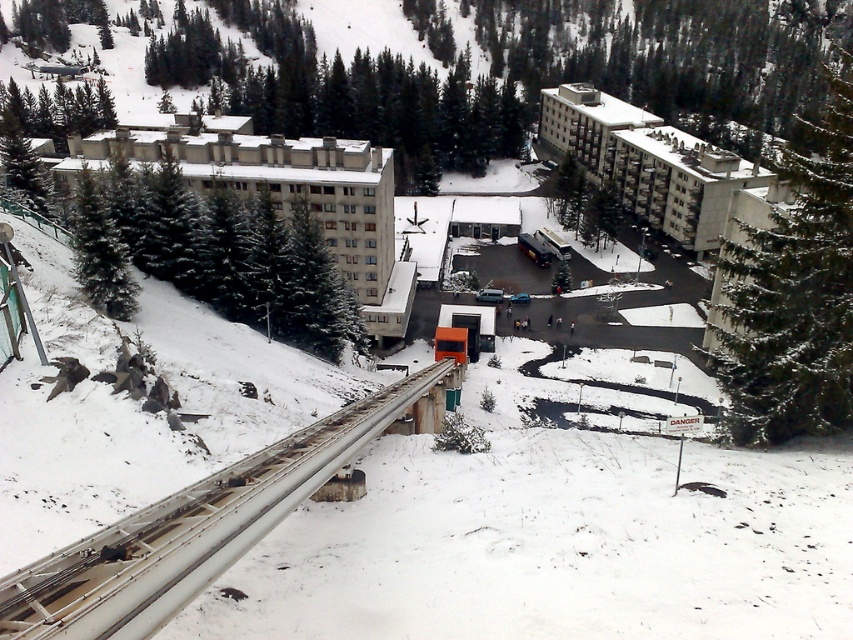
Question: Can you confirm if white metallic train track at lower left is positioned above beige concrete building at center-left?

Choices:
 (A) yes
 (B) no

Answer: (B)

Question: Which of the following is the farthest from the observer?

Choices:
 (A) (378, 244)
 (B) (341, 419)
 (C) (566, 138)

Answer: (C)

Question: Which object appears closest to the camera in this image?

Choices:
 (A) green textured pine at right
 (B) beige concrete building at center-left
 (C) white metallic train track at lower left

Answer: (C)

Question: Is white metallic train track at lower left below green textured pine at right?

Choices:
 (A) yes
 (B) no

Answer: (A)

Question: Considering the real-world distances, which object is closest to the green textured pine at right?

Choices:
 (A) white metallic train track at lower left
 (B) white concrete building at center-right

Answer: (B)

Question: Does green textured pine at right have a larger size compared to beige concrete building at center-left?

Choices:
 (A) no
 (B) yes

Answer: (B)